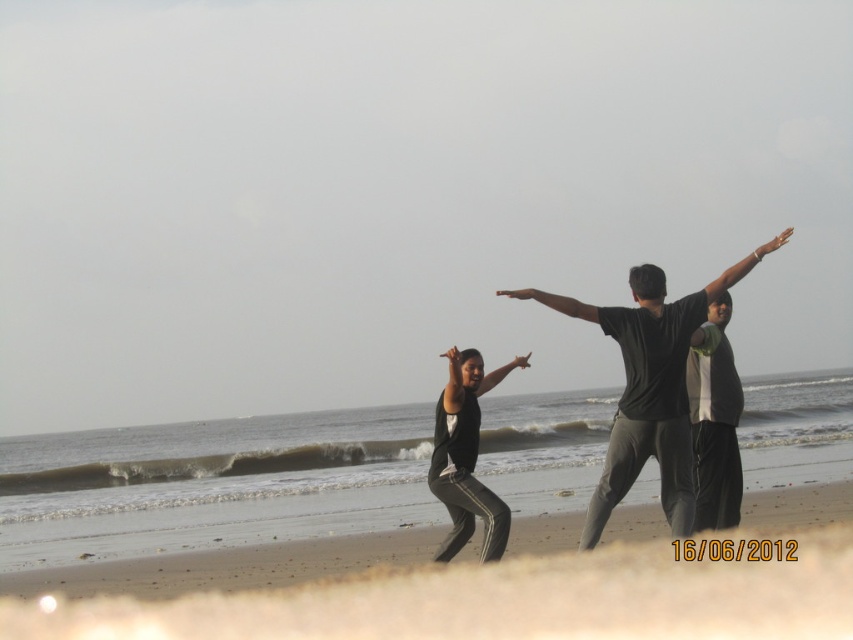
Question: Which point is farther to the camera?

Choices:
 (A) dark gray cotton shirt at right
 (B) black matte pants at center
 (C) black matte shirt at center
 (D) beige sandy beach at lower center

Answer: (A)

Question: Which object appears farthest from the camera in this image?

Choices:
 (A) beige sandy beach at lower center
 (B) black matte shirt at center
 (C) black matte arm at center

Answer: (C)

Question: Which point is farther to the camera?

Choices:
 (A) (569, 298)
 (B) (489, 381)
 (C) (717, 276)
 (D) (672, 465)

Answer: (C)

Question: Observing the image, what is the correct spatial positioning of beige sandy beach at lower center in reference to black matte pants at center?

Choices:
 (A) above
 (B) below

Answer: (B)

Question: Does black matte arm at upper center have a smaller size compared to black matte arm at center?

Choices:
 (A) yes
 (B) no

Answer: (B)

Question: Does black matte arm at upper right appear on the right side of black matte arm at center?

Choices:
 (A) yes
 (B) no

Answer: (A)